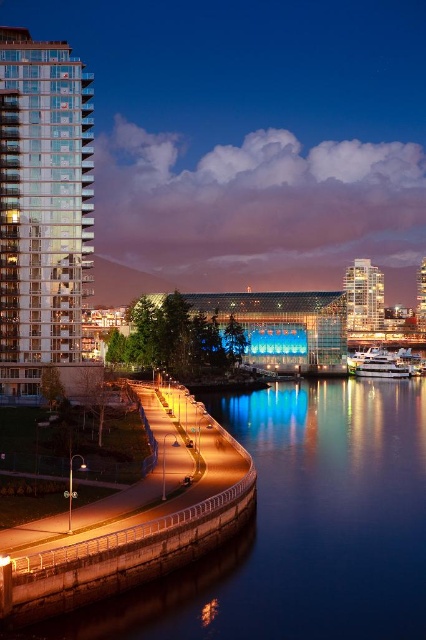
You are standing on the curved pathway near the blue glassy river at lower center. You want to throw a small pebble into the river. Considering the distance between you and the river, will the pebble reach the water if you throw it with a typical arm strength?

The blue glassy river at lower center is 29.86 meters away from the viewer. Since the average throwing distance for a small pebble is around 15 to 20 meters, the pebble will not reach the river.

You are a tourist standing on the curved pathway and want to take a photo of both the blue glassy river at lower center and the matte glass building at upper right. Which object should you position to your left side in the frame?

You should position the blue glassy river at lower center to your left side in the frame because it is already located to the left of the matte glass building at upper right.

You are a photographer planning to take a wide shot of the blue glassy river at lower center and the transparent glass building at left. Which object will appear smaller in the photo?

The blue glassy river at lower center will appear smaller in the photo because it is smaller than the transparent glass building at left according to the description.